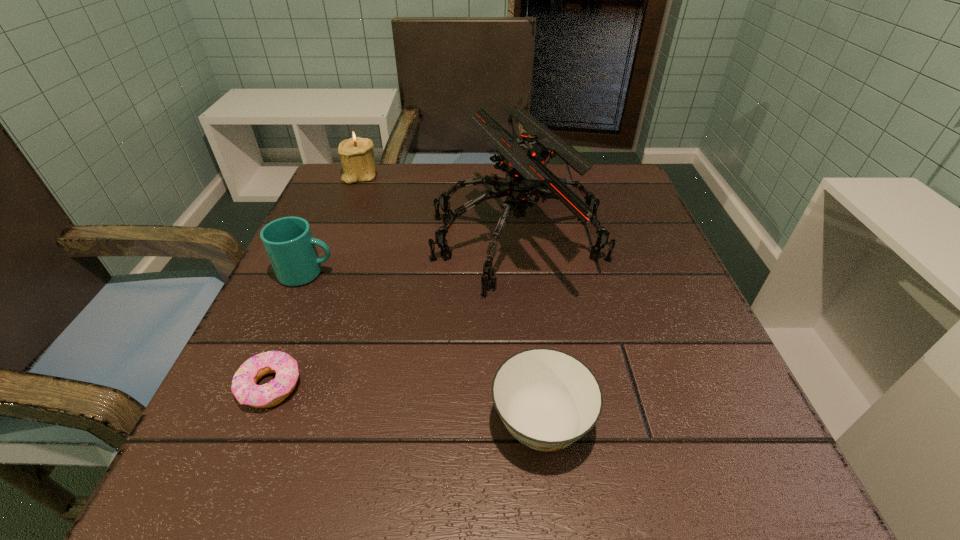
Locate an element on the screen. free point located 0.230m on the back of the doughnut is located at coordinates (320, 266).

At what (x,y) coordinates should I click in order to perform the action: click on drone that is at the far edge. Please return your answer as a coordinate pair (x, y). Image resolution: width=960 pixels, height=540 pixels. Looking at the image, I should click on (524, 159).

Identify the location of candle_holder that is at the far edge. The height and width of the screenshot is (540, 960). (356, 154).

Image resolution: width=960 pixels, height=540 pixels. Identify the location of object that is at the near edge. (548, 399).

Find the location of a particular element. The width and height of the screenshot is (960, 540). candle_holder positioned at the left edge is located at coordinates (356, 154).

Locate an element on the screen. The image size is (960, 540). cup positioned at the left edge is located at coordinates (288, 241).

Find the location of a particular element. doughnut positioned at the left edge is located at coordinates (244, 386).

The width and height of the screenshot is (960, 540). Find the location of `object that is at the right edge`. object that is at the right edge is located at coordinates 524,159.

You are a GUI agent. You are given a task and a screenshot of the screen. Output one action in this format:
    pyautogui.click(x=<x>, y=<y>)
    Task: Click on the object that is positioned at the far left corner
    
    Given the screenshot: What is the action you would take?
    pyautogui.click(x=356, y=154)

Find the location of a particular element. object positioned at the far right corner is located at coordinates (524, 159).